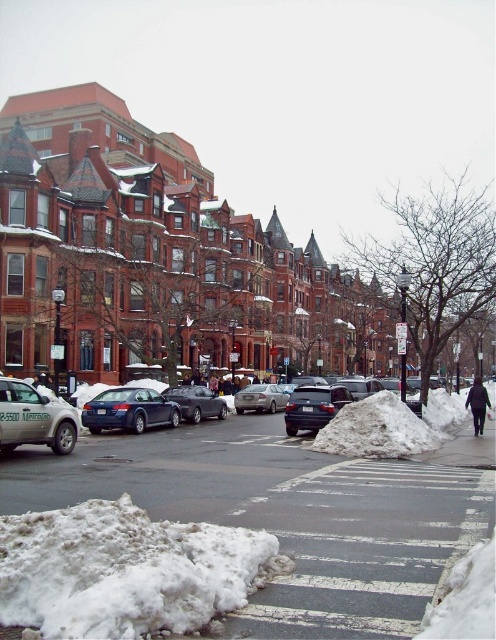
Question: Among these points, which one is farthest from the camera?

Choices:
 (A) (22, 515)
 (B) (152, 394)
 (C) (171, 400)
 (D) (26, 422)

Answer: (C)

Question: Does green matte taxi at lower left have a smaller size compared to shiny black sedan at center?

Choices:
 (A) no
 (B) yes

Answer: (A)

Question: From the image, what is the correct spatial relationship of white fluffy snow at lower left in relation to satin black sedan at center?

Choices:
 (A) above
 (B) below

Answer: (A)

Question: Which of the following is the closest to the observer?

Choices:
 (A) green matte taxi at lower left
 (B) shiny black sedan at center

Answer: (A)

Question: Can you confirm if white fluffy snow at lower left is positioned below shiny blue sedan at center?

Choices:
 (A) yes
 (B) no

Answer: (B)

Question: Which point is farther from the camera taking this photo?

Choices:
 (A) (51, 404)
 (B) (213, 413)
 (C) (333, 406)

Answer: (B)